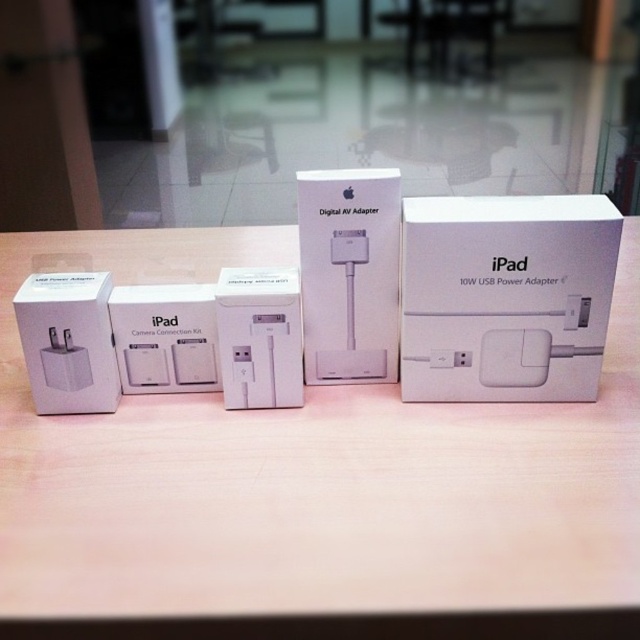
Does white matte power adapter at left have a lesser width compared to white matte ipad camera connection kit at left?

Yes.

Looking at this image, can you confirm if white matte power adapter at left is shorter than white matte ipad camera connection kit at left?

No.

Who is more distant from viewer, (88,307) or (145,342)?

Point (145,342)

Locate an element on the screen. white matte power adapter at left is located at coordinates (68, 340).

Who is more distant from viewer, (484, 548) or (216, 364)?

Point (216, 364)

Between white matte table at center and white matte ipad camera connection kit at left, which one has more height?

white matte table at center

Locate an element on the screen. white matte table at center is located at coordinates (x=314, y=481).

I want to click on white matte table at center, so (x=314, y=481).

Is point (442, 225) in front of point (93, 348)?

Yes, point (442, 225) is in front of point (93, 348).

Is point (483, 333) farther from viewer compared to point (92, 376)?

No, (483, 333) is in front of (92, 376).

This screenshot has width=640, height=640. What are the coordinates of `white matte ipad power adapter at center` in the screenshot? It's located at (506, 296).